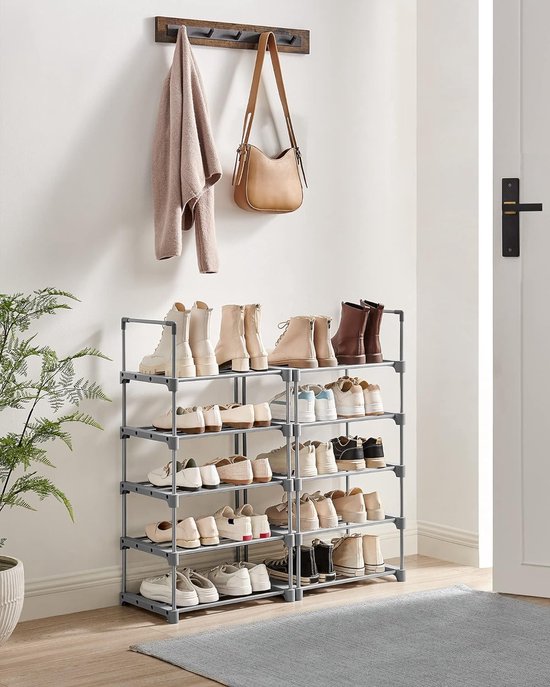
Identify the location of shoes on fourth shelf. The image size is (550, 687). (192, 424), (216, 420), (235, 416), (260, 415), (296, 411), (331, 407), (346, 405), (370, 402).